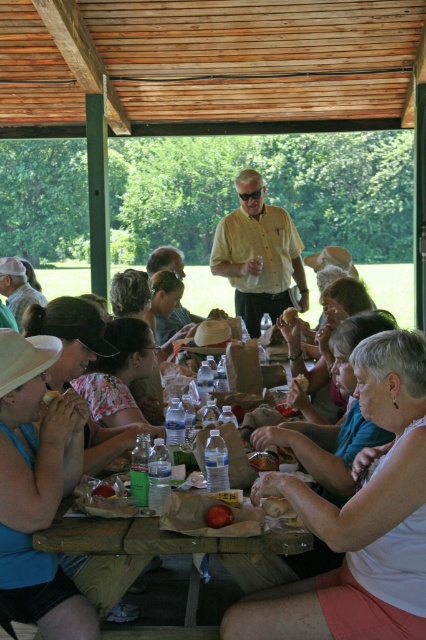
Can you confirm if wooden picnic table at center is shorter than yellow matte shirt at center?

Yes.

Who is more forward, (109, 545) or (226, 230)?

Positioned in front is point (109, 545).

The image size is (426, 640). Find the location of `wooden picnic table at center`. wooden picnic table at center is located at coordinates (164, 552).

Can you confirm if matte blue shirt at lower left is positioned to the right of yellow matte shirt at center?

Incorrect, matte blue shirt at lower left is not on the right side of yellow matte shirt at center.

Locate an element on the screen. matte blue shirt at lower left is located at coordinates (36, 436).

Locate an element on the screen. The height and width of the screenshot is (640, 426). matte blue shirt at lower left is located at coordinates (36, 436).

This screenshot has width=426, height=640. What do you see at coordinates (359, 518) in the screenshot? I see `white cotton shirt at center` at bounding box center [359, 518].

Who is more distant from viewer, (386, 577) or (259, 307)?

The point (259, 307) is more distant.

Does point (337, 545) come closer to viewer compared to point (265, 209)?

Yes, point (337, 545) is in front of point (265, 209).

Identify the location of white cotton shirt at center. This screenshot has height=640, width=426. (359, 518).